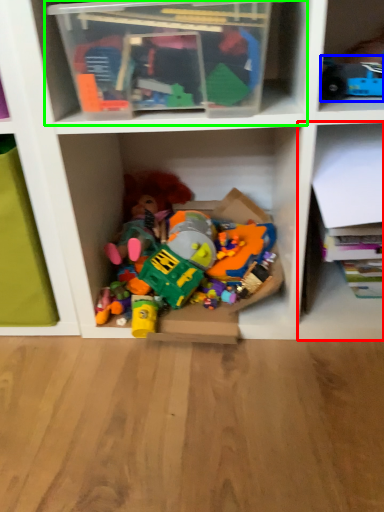
Question: Based on their relative distances, which object is farther from shelf (highlighted by a red box)? Choose from toy (highlighted by a blue box) and shelf (highlighted by a green box).

Choices:
 (A) toy
 (B) shelf

Answer: (B)